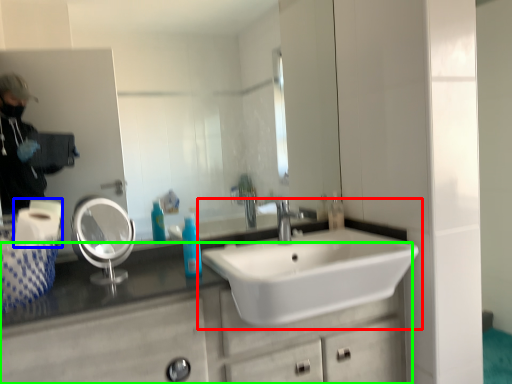
Question: Based on their relative distances, which object is nearer to sink (highlighted by a red box)? Choose from toilet paper (highlighted by a blue box) and bathroom cabinet (highlighted by a green box).

Choices:
 (A) toilet paper
 (B) bathroom cabinet

Answer: (B)